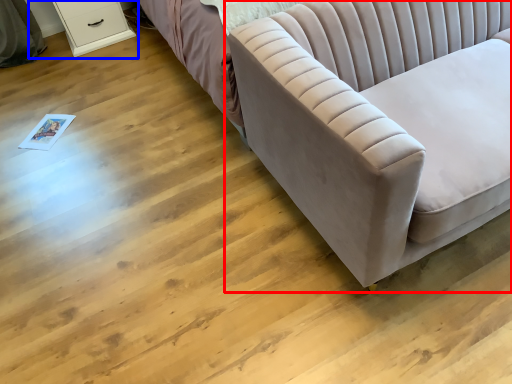
Question: Among these objects, which one is farthest to the camera, studio couch (highlighted by a red box) or dresser (highlighted by a blue box)?

Choices:
 (A) studio couch
 (B) dresser

Answer: (B)